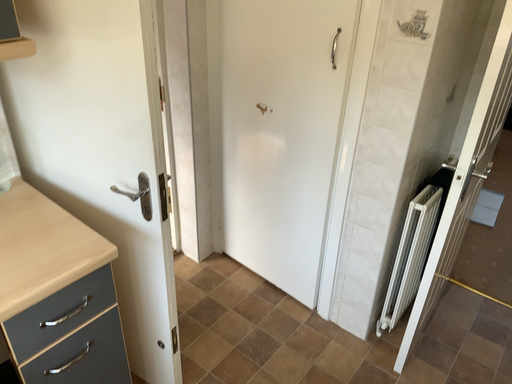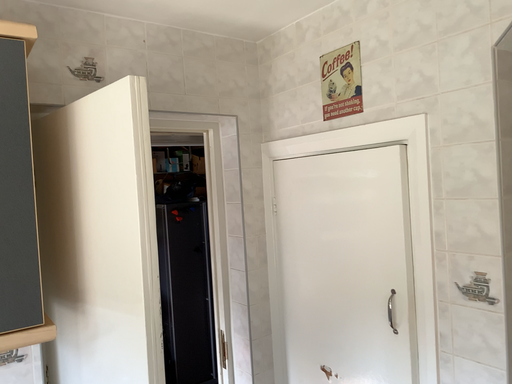
Question: Which way did the camera rotate in the video?

Choices:
 (A) rotated left
 (B) rotated right

Answer: (A)